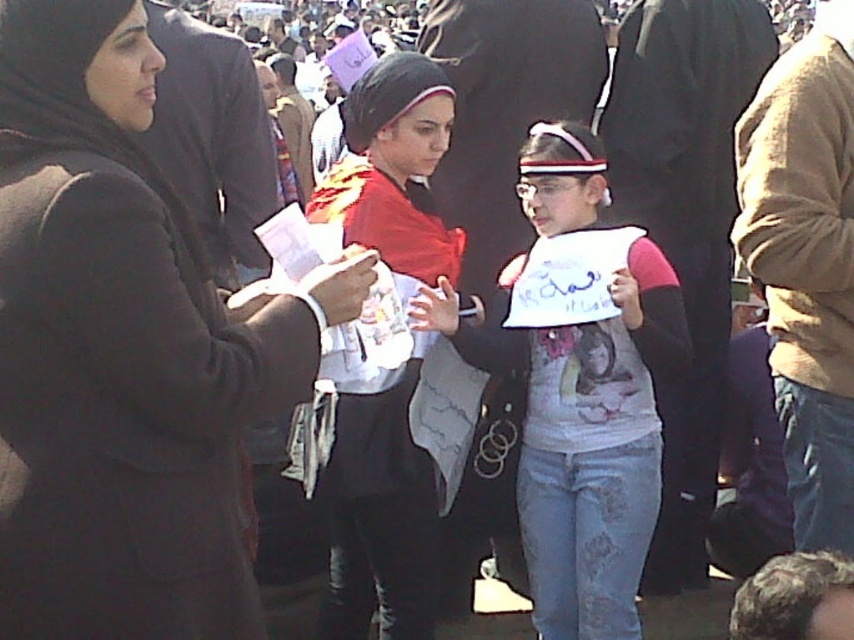
Is dark brown coat at left behind matte black hijab at center?

That is False.

This screenshot has height=640, width=854. Describe the element at coordinates (124, 353) in the screenshot. I see `dark brown coat at left` at that location.

Is point (97, 104) positioned in front of point (402, 84)?

Yes, it is in front of point (402, 84).

This screenshot has width=854, height=640. In order to click on dark brown coat at left in this screenshot , I will do `click(124, 353)`.

Does white paper sign at center appear on the right side of matte black hijab at center?

Indeed, white paper sign at center is positioned on the right side of matte black hijab at center.

Does point (609, 561) lie behind point (384, 404)?

That is True.

Find the location of `white paper sign at center`. white paper sign at center is located at coordinates pyautogui.click(x=583, y=436).

Which of these two, dark brown coat at left or white paper sign at center, stands shorter?

Standing shorter between the two is dark brown coat at left.

Which is behind, point (73, 120) or point (616, 417)?

The point (616, 417) is more distant.

Does point (48, 99) lie in front of point (629, 260)?

Yes, point (48, 99) is in front of point (629, 260).

This screenshot has width=854, height=640. Identify the location of dark brown coat at left. (124, 353).